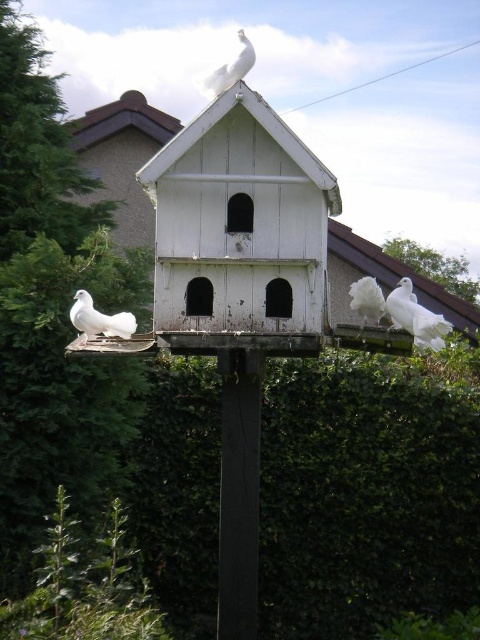
Question: Which point is farther to the camera?

Choices:
 (A) white glossy dove at lower left
 (B) white feathered dove at right
 (C) white wood bird feeder at center

Answer: (A)

Question: Is white fluffy bird at upper right wider than white feathered dove at center?

Choices:
 (A) no
 (B) yes

Answer: (A)

Question: Is white wood bird feeder at center thinner than white feathered dove at right?

Choices:
 (A) no
 (B) yes

Answer: (A)

Question: Which point is farther to the camera?

Choices:
 (A) (350, 285)
 (B) (133, 326)
 (C) (406, 317)

Answer: (A)

Question: Is green leafy hedge at center thinner than white feathered dove at right?

Choices:
 (A) no
 (B) yes

Answer: (A)

Question: Which point appears closest to the camera in this image?

Choices:
 (A) (411, 294)
 (B) (256, 132)
 (C) (348, 568)

Answer: (B)